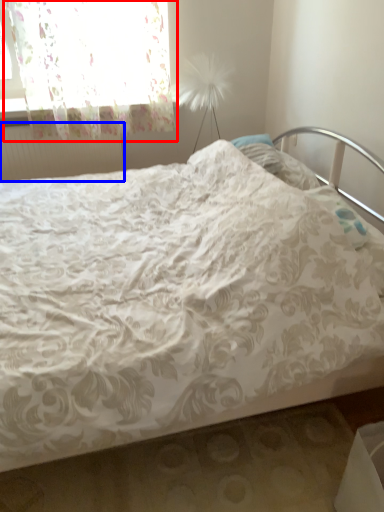
Question: Which of the following is the closest to the observer, curtain (highlighted by a red box) or radiator (highlighted by a blue box)?

Choices:
 (A) curtain
 (B) radiator

Answer: (A)